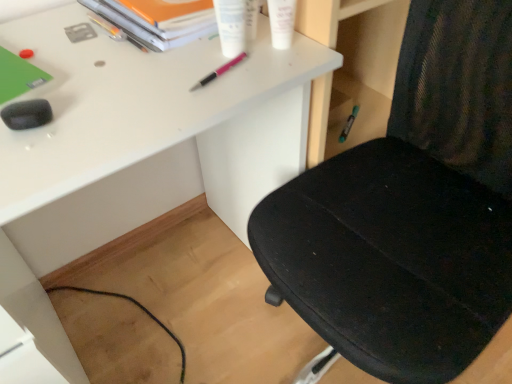
Question: Is orange matte paper at upper center directly adjacent to white matte desk at center?

Choices:
 (A) yes
 (B) no

Answer: (B)

Question: Does orange matte paper at upper center appear on the right side of white matte desk at center?

Choices:
 (A) no
 (B) yes

Answer: (B)

Question: Is orange matte paper at upper center facing towards white matte desk at center?

Choices:
 (A) no
 (B) yes

Answer: (A)

Question: Does orange matte paper at upper center have a smaller size compared to white matte desk at center?

Choices:
 (A) no
 (B) yes

Answer: (B)

Question: Is orange matte paper at upper center not close to white matte desk at center?

Choices:
 (A) no
 (B) yes

Answer: (A)

Question: In the image, is white matte desk at center positioned in front of or behind white plastic tubes at upper center, which ranks as the 3th stationery in front-to-back order?

Choices:
 (A) front
 (B) behind

Answer: (A)

Question: Visually, is white matte desk at center positioned to the left or to the right of white plastic tubes at upper center, the fourth stationery positioned from the back?

Choices:
 (A) right
 (B) left

Answer: (B)

Question: From the image's perspective, is white matte desk at center located above or below white plastic tubes at upper center, positioned as the 4th stationery in left-to-right order?

Choices:
 (A) below
 (B) above

Answer: (A)

Question: Considering the positions of white matte desk at center and white plastic tubes at upper center, which is counted as the third stationery, starting from the right, in the image, is white matte desk at center taller or shorter than white plastic tubes at upper center, which is counted as the third stationery, starting from the right,?

Choices:
 (A) tall
 (B) short

Answer: (A)

Question: Looking at their shapes, would you say orange matte paper at upper center is wider or thinner than black mesh chair at right?

Choices:
 (A) thin
 (B) wide

Answer: (A)

Question: From a real-world perspective, is orange matte paper at upper center above or below black mesh chair at right?

Choices:
 (A) below
 (B) above

Answer: (B)

Question: Is orange matte paper at upper center spatially inside black mesh chair at right, or outside of it?

Choices:
 (A) inside
 (B) outside

Answer: (B)

Question: Is point (115, 23) closer or farther from the camera than point (443, 355)?

Choices:
 (A) closer
 (B) farther

Answer: (B)

Question: Considering the positions of point (465, 153) and point (214, 77), is point (465, 153) closer or farther from the camera than point (214, 77)?

Choices:
 (A) farther
 (B) closer

Answer: (A)

Question: Would you say black mesh chair at right is to the left or to the right of pink metallic pen at upper center, which is the 4th stationery from front to back, in the picture?

Choices:
 (A) right
 (B) left

Answer: (A)